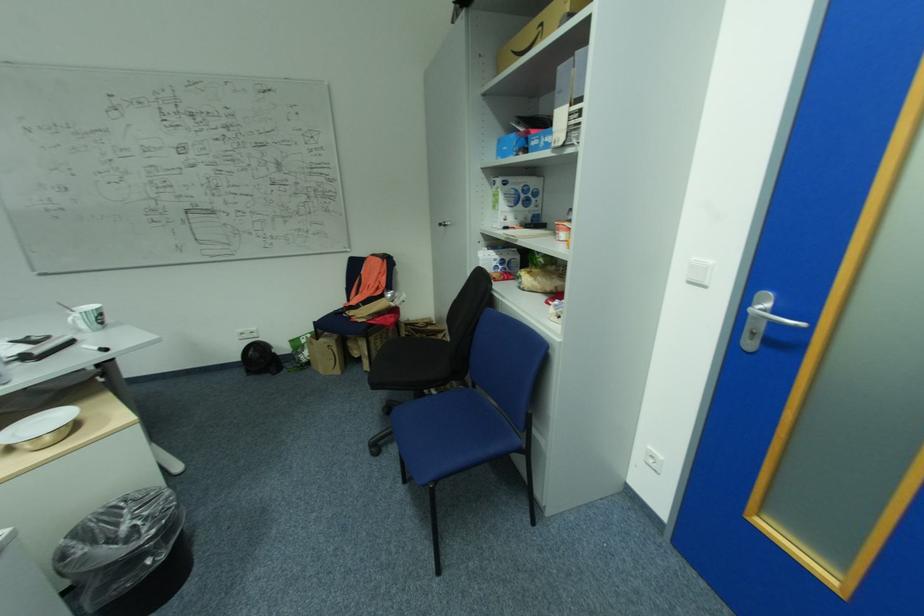
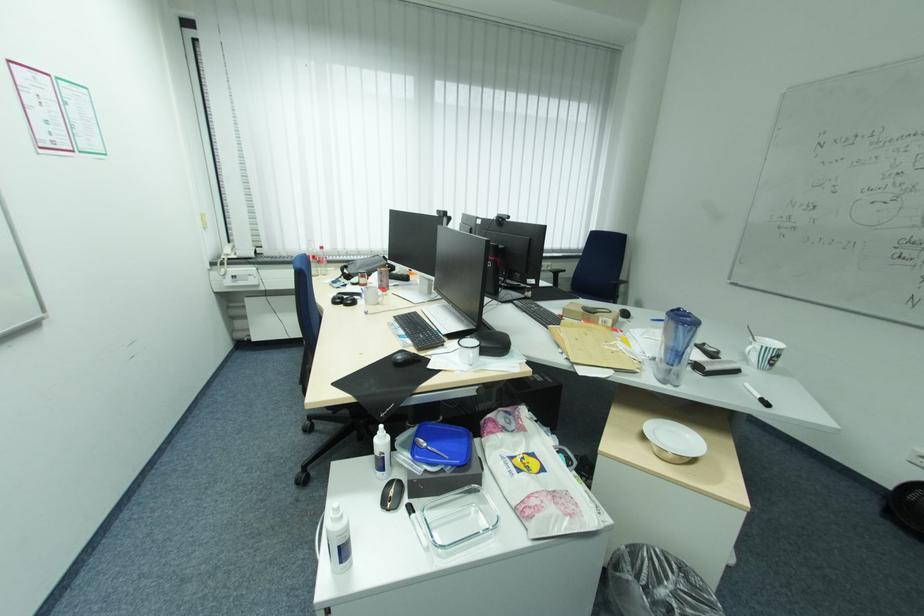
In the second image, find the point that corresponds to pixel 86 330 in the first image.

(752, 360)